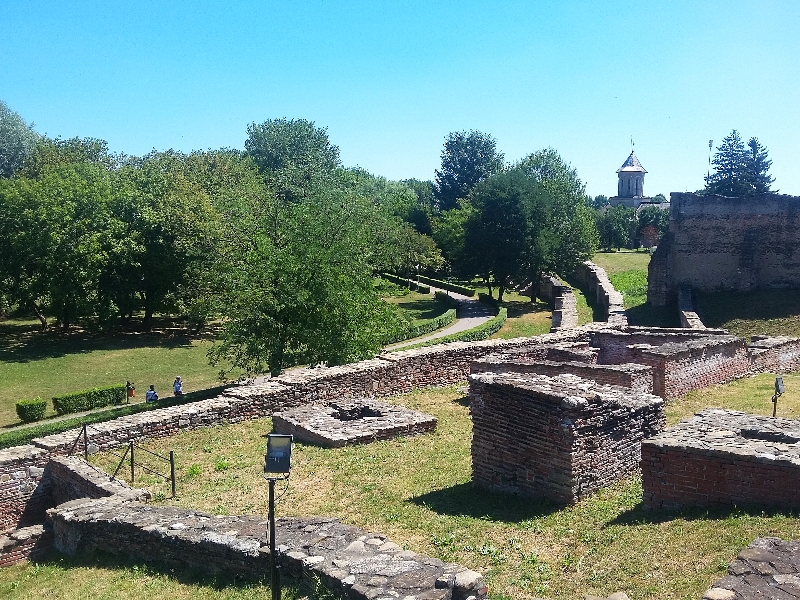
Where is `lights`? lights is located at coordinates (274, 473), (777, 394).